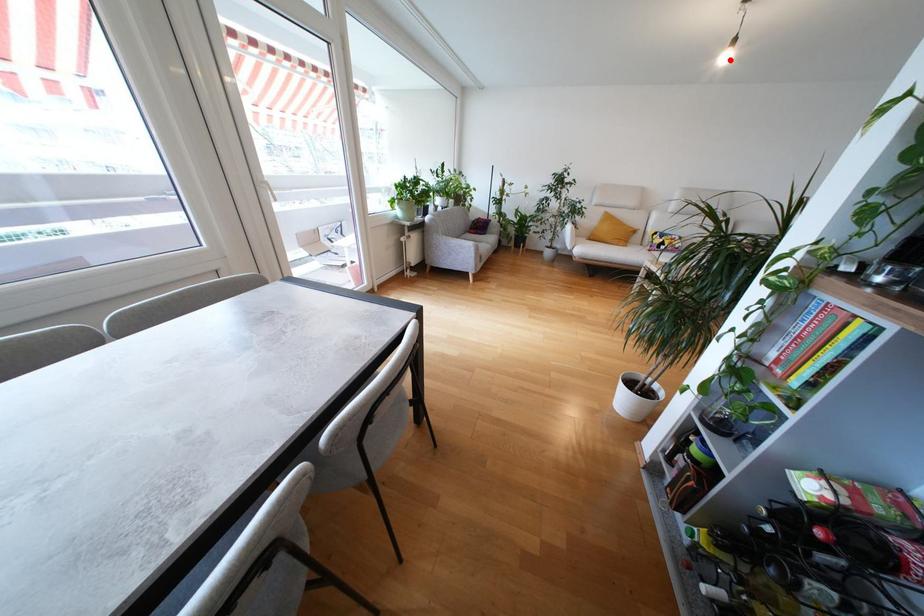
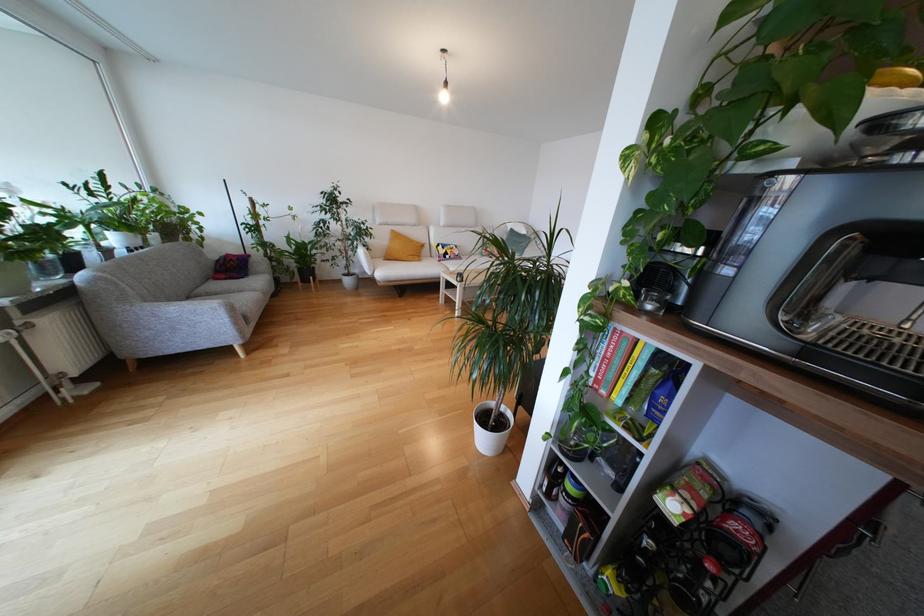
Question: I am providing you with two images of the same scene from different viewpoints. Image1 has a red point marked. In image2, the corresponding 3D location appears at what relative position? Reply with the corresponding letter.

Choices:
 (A) Closer
 (B) Farther

Answer: (A)